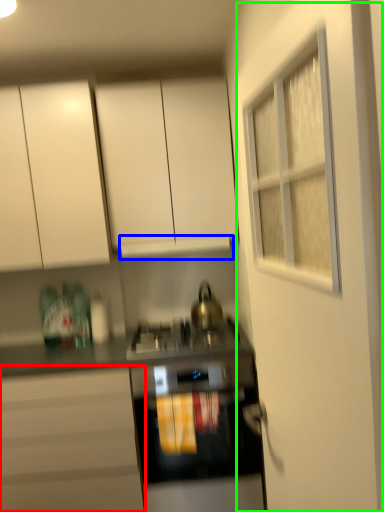
Question: Which object is the farthest from cabinetry (highlighted by a red box)? Choose among these: exhaust hood (highlighted by a blue box) or door (highlighted by a green box).

Choices:
 (A) exhaust hood
 (B) door

Answer: (B)